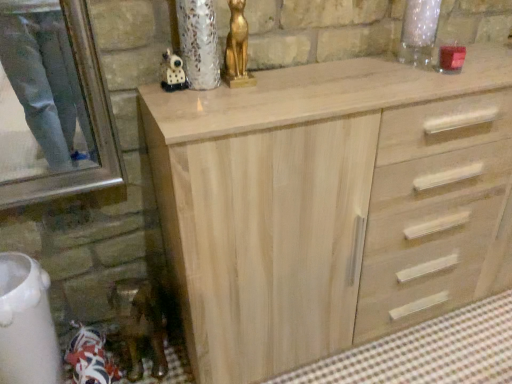
You are a GUI agent. You are given a task and a screenshot of the screen. Output one action in this format:
    pyautogui.click(x=<x>, y=<y>)
    Task: Click on the vacant area located to the right-hand side of gold metallic cat statue at upper center
    This screenshot has width=512, height=384.
    Given the screenshot: What is the action you would take?
    pyautogui.click(x=295, y=74)